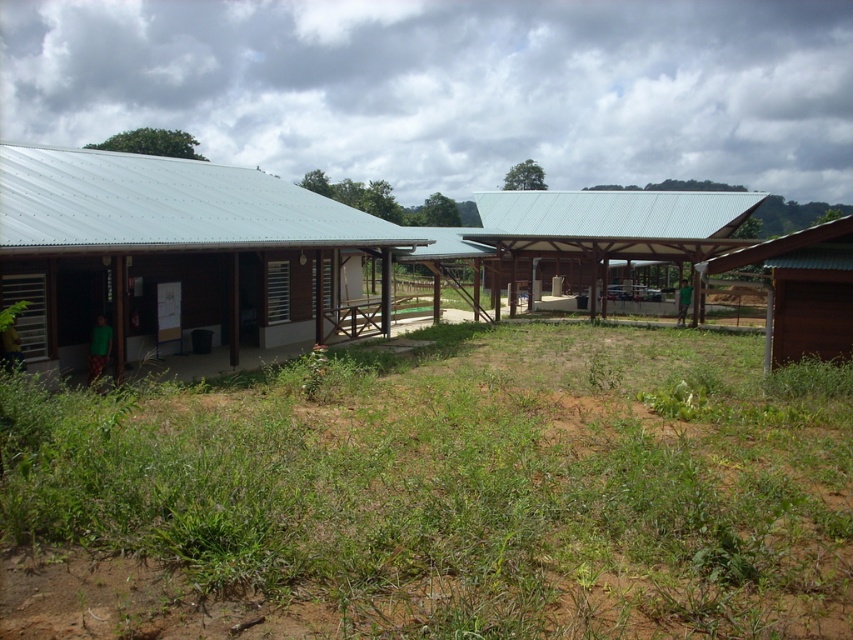
You are planning to plant a new garden between the two buildings. Which area would be more suitable for planting based on the thickness of the green grass at center and metallic roof at center?

The green grass at center is thinner than the metallic roof at center, so the area with the metallic roof at center would be more suitable for planting since it has thicker vegetation.

You need to place a large storage container that requires a 10 meter wide space. You are standing between the metallic corrugated roof at left and the metallic roof at center. Which area has enough width to accommodate the container?

The metallic roof at center has a width greater than the metallic corrugated roof at left, so the metallic roof at center can accommodate the container if its width meets or exceeds 10 meters.

You are a landscape architect planning to install a new sprinkler system between the two buildings. The sprinkler requires a clear space of at least 1 meter between the grass and any obstacles. Based on the scene, will the metallic roof at center interfere with the sprinkler installation near the green grass at center?

The green grass at center is shorter than the metallic roof at center, so the metallic roof at center is taller. Since the sprinkler requires a clear space of at least 1 meter between the grass and obstacles, the height difference alone doesn not determine clearance. However, the description does not provide exact measurements of their heights or distances, so it is unclear if the metallic roof at center would interfere. More information is needed to determine feasibility.